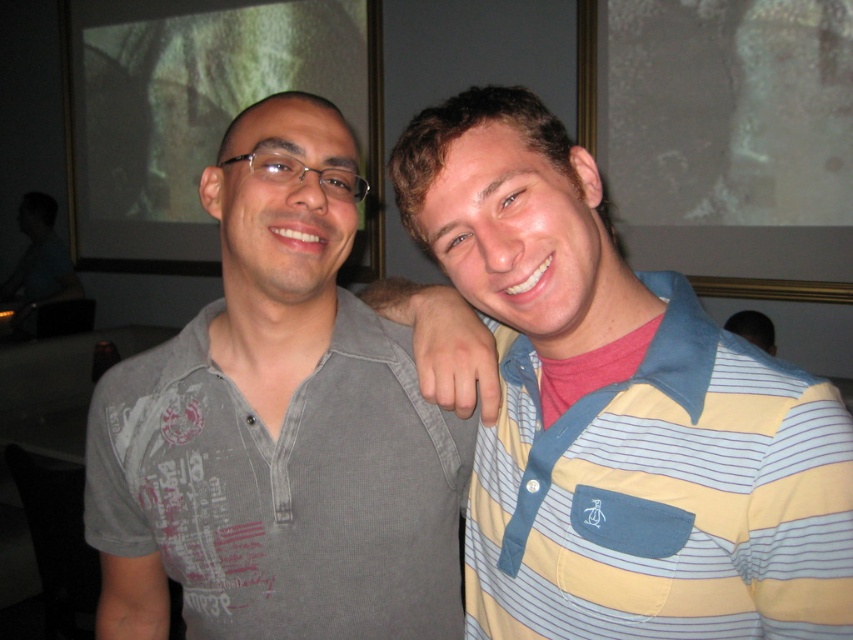
Question: Does gray cotton shirt at left lie in front of yellow and blue striped polo shirt at right?

Choices:
 (A) yes
 (B) no

Answer: (B)

Question: Which point is closer to the camera?

Choices:
 (A) gray cotton shirt at left
 (B) yellow and blue striped polo shirt at right

Answer: (B)

Question: From the image, what is the correct spatial relationship of gray cotton shirt at left in relation to yellow and blue striped polo shirt at right?

Choices:
 (A) above
 (B) below

Answer: (A)

Question: Where is gray cotton shirt at left located in relation to yellow and blue striped polo shirt at right in the image?

Choices:
 (A) left
 (B) right

Answer: (A)

Question: Which point is closer to the camera taking this photo?

Choices:
 (A) (836, 582)
 (B) (144, 545)

Answer: (A)

Question: Among these objects, which one is nearest to the camera?

Choices:
 (A) gray cotton shirt at left
 (B) yellow and blue striped polo shirt at right

Answer: (B)